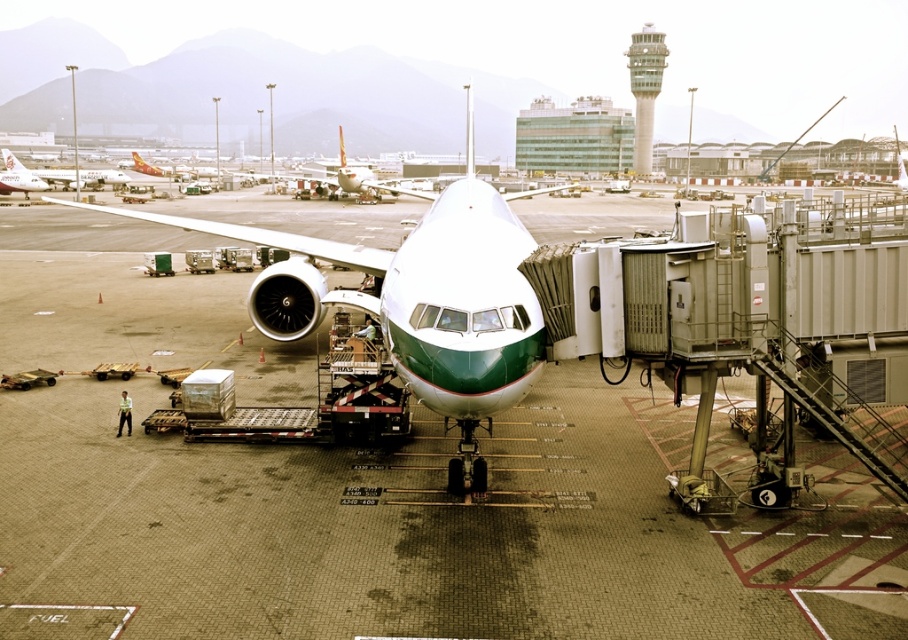
You are a maintenance worker standing on the smooth concrete tarmac at center and looking towards the matte white airplane at left. Which object is higher in elevation?

The smooth concrete tarmac at center is taller than the matte white airplane at left, so the smooth concrete tarmac at center is higher in elevation.

You are a pilot taxiing the matte white airplane at left towards the gate. You need to pass under the green glass control tower at upper center. Can you do so without any issues?

The matte white airplane at left is behind the green glass control tower at upper center, so it is already positioned behind it. Therefore, there is no need to pass under the tower, as it is already in a safe position.